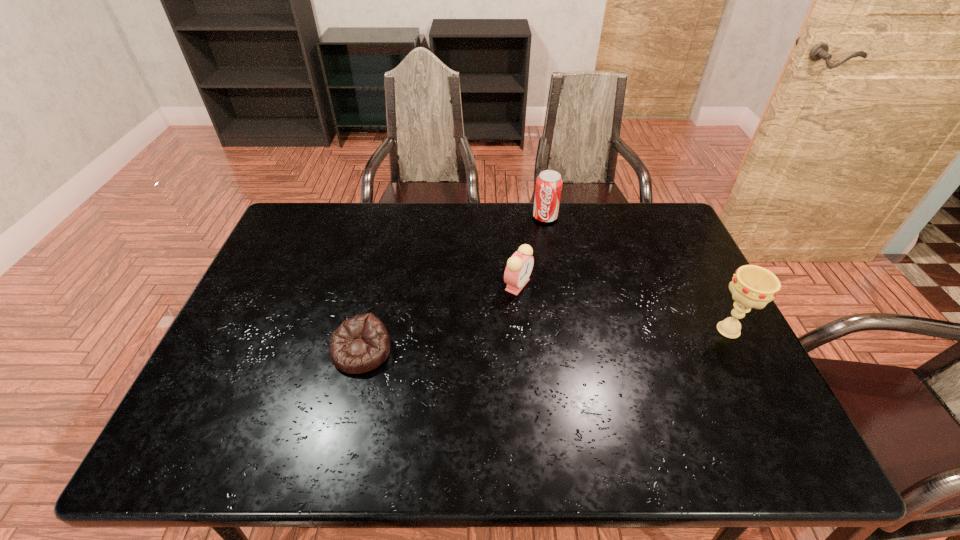
Locate an element on the screen. The height and width of the screenshot is (540, 960). blank space located 0.180m on the face of the third tallest object is located at coordinates (549, 346).

At what (x,y) coordinates should I click in order to perform the action: click on blank area located 0.360m on the face of the third tallest object. Please return your answer as a coordinate pair (x, y). Looking at the image, I should click on (581, 407).

Where is `vacant space located 0.200m on the logo side of the third object from left to right`? Image resolution: width=960 pixels, height=540 pixels. vacant space located 0.200m on the logo side of the third object from left to right is located at coordinates (529, 262).

This screenshot has height=540, width=960. What are the coordinates of `free space located 0.050m on the logo side of the third object from left to right` in the screenshot? It's located at (540, 233).

The width and height of the screenshot is (960, 540). I want to click on free space located on the logo side of the third object from left to right, so click(517, 291).

Where is `object located in the far edge section of the desktop`? The image size is (960, 540). object located in the far edge section of the desktop is located at coordinates (549, 183).

You are a GUI agent. You are given a task and a screenshot of the screen. Output one action in this format:
    pyautogui.click(x=<x>, y=<y>)
    Task: Click on the object that is at the right edge
    The width and height of the screenshot is (960, 540).
    Given the screenshot: What is the action you would take?
    pyautogui.click(x=752, y=286)

Find the location of `vacant space at the far edge of the desktop`. vacant space at the far edge of the desktop is located at coordinates (500, 208).

The height and width of the screenshot is (540, 960). What are the coordinates of `free space at the left edge of the desktop` in the screenshot? It's located at (298, 291).

The height and width of the screenshot is (540, 960). What are the coordinates of `blank space at the right edge of the desktop` in the screenshot? It's located at (750, 363).